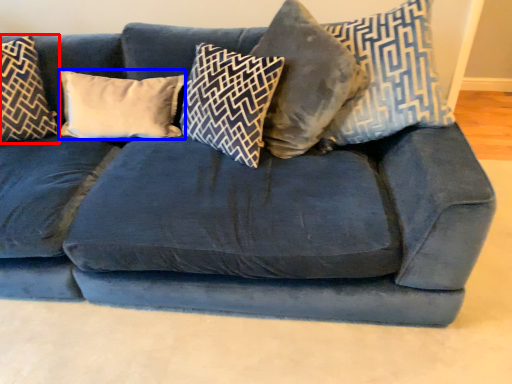
Question: Which point is closer to the camera, pillow (highlighted by a red box) or pillow (highlighted by a blue box)?

Choices:
 (A) pillow
 (B) pillow

Answer: (A)